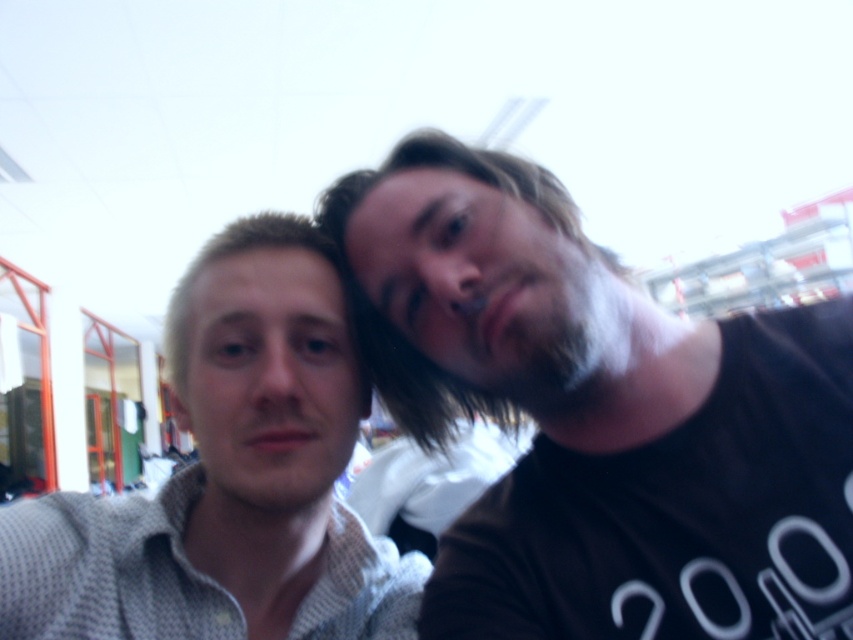
Can you confirm if dark brown t-shirt at center is positioned to the right of light gray textured shirt at left?

Yes, dark brown t-shirt at center is to the right of light gray textured shirt at left.

Does dark brown t-shirt at center lie behind light gray textured shirt at left?

No, it is not.

Describe the element at coordinates (602, 417) in the screenshot. I see `dark brown t-shirt at center` at that location.

Find the location of a particular element. Image resolution: width=853 pixels, height=640 pixels. dark brown t-shirt at center is located at coordinates (602, 417).

Between light gray textured shirt at left and dark brown fuzzy beard at center, which one appears on the left side from the viewer's perspective?

light gray textured shirt at left

Is light gray textured shirt at left to the right of dark brown fuzzy beard at center from the viewer's perspective?

In fact, light gray textured shirt at left is to the left of dark brown fuzzy beard at center.

Where is `light gray textured shirt at left`? light gray textured shirt at left is located at coordinates (229, 477).

Does dark brown t-shirt at center have a lesser height compared to dark brown fuzzy beard at center?

Incorrect, dark brown t-shirt at center's height does not fall short of dark brown fuzzy beard at center's.

Is point (726, 545) positioned before point (601, 259)?

That is True.

What do you see at coordinates (602, 417) in the screenshot? I see `dark brown t-shirt at center` at bounding box center [602, 417].

I want to click on dark brown t-shirt at center, so click(602, 417).